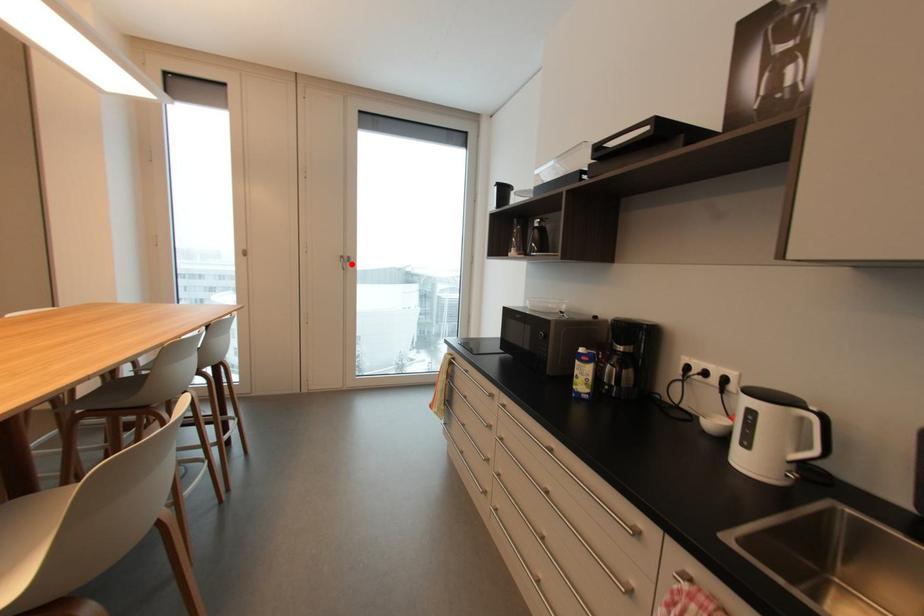
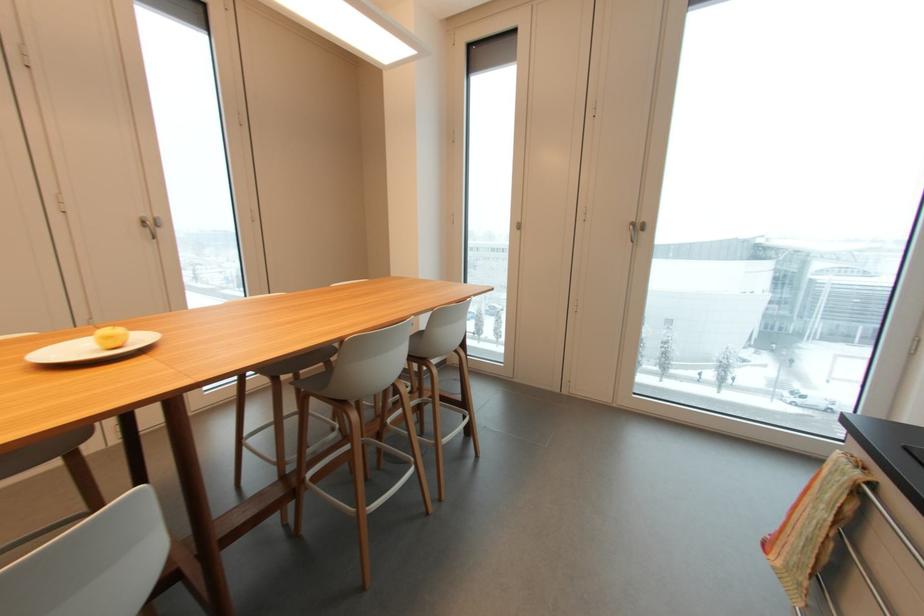
Question: I am providing you with two images of the same scene from different viewpoints. A red point is marked on the first image. Is the red point's position out of view in image 2?

Choices:
 (A) Yes
 (B) No

Answer: (B)